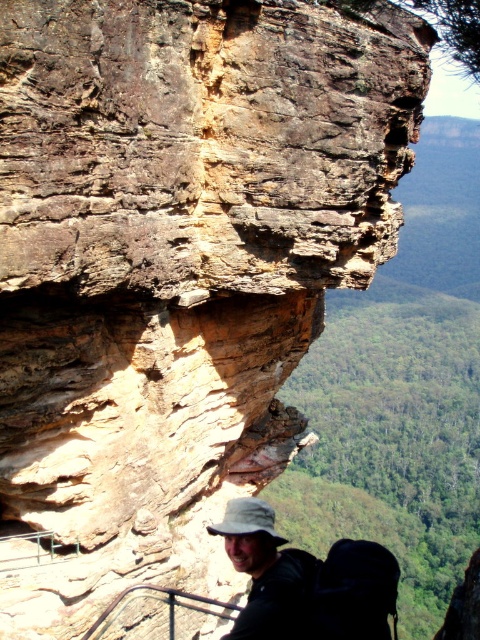
You are a hiker trying to reach the khaki fabric hat at center from the matte khaki hat at lower center. Given that you can only move in a straight line, will you be able to reach it without crossing the cliff edge marked by the metal railing?

The matte khaki hat at lower center and khaki fabric hat at center are 1.79 meters apart. Since the distance between them is less than the 2 meters required to cross the cliff edge, you can reach the khaki fabric hat at center without crossing the edge.